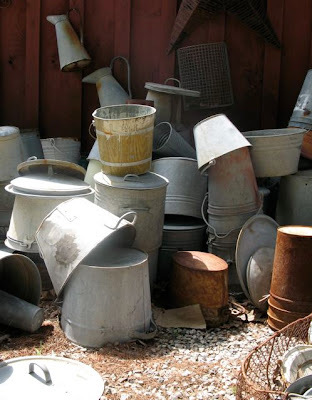
Locate an element on the screen. The height and width of the screenshot is (400, 312). metal pitcher is located at coordinates (73, 47).